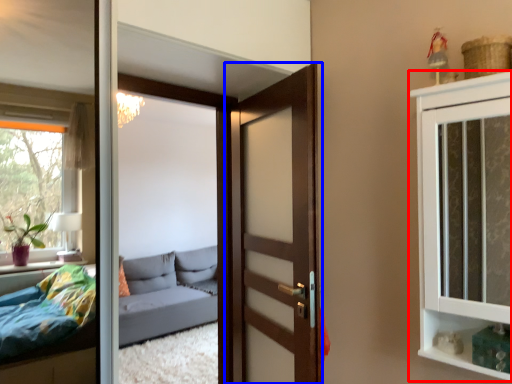
Question: Which of the following is the farthest to the observer, cabinetry (highlighted by a red box) or door (highlighted by a blue box)?

Choices:
 (A) cabinetry
 (B) door

Answer: (B)